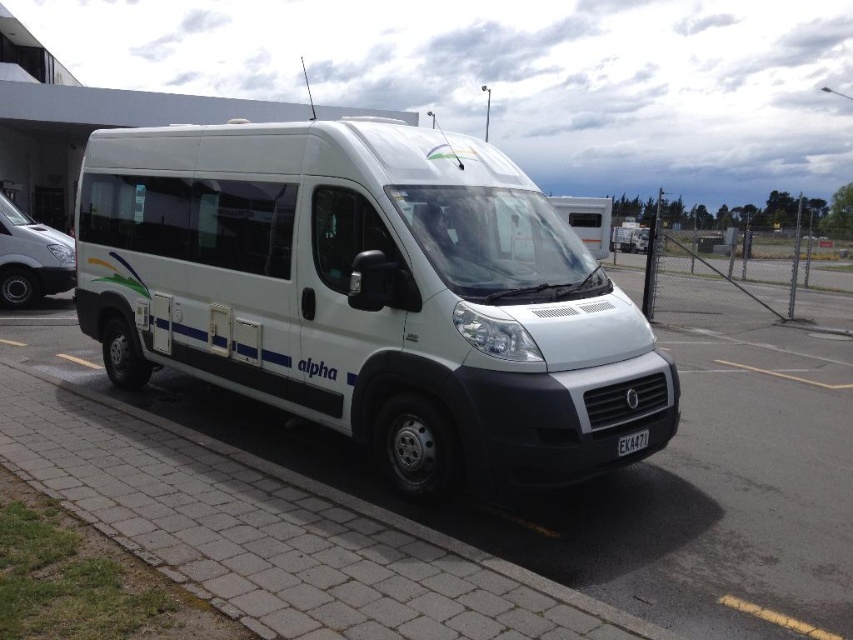
Question: Considering the real-world distances, which object is closest to the silver metallic van at left?

Choices:
 (A) white brick pavement at center
 (B) white matte van at center

Answer: (A)

Question: Based on their relative distances, which object is farther from the white brick pavement at center?

Choices:
 (A) black plastic license plate at front
 (B) silver metallic van at left

Answer: (B)

Question: Does white matte van at center have a smaller size compared to silver metallic van at left?

Choices:
 (A) yes
 (B) no

Answer: (A)

Question: Observing the image, what is the correct spatial positioning of white brick pavement at center in reference to silver metallic van at left?

Choices:
 (A) below
 (B) above

Answer: (A)

Question: Which object is positioned closest to the white brick pavement at center?

Choices:
 (A) silver metallic van at left
 (B) white matte van at center

Answer: (A)

Question: Can you confirm if white brick pavement at center is smaller than black plastic license plate at front?

Choices:
 (A) yes
 (B) no

Answer: (B)